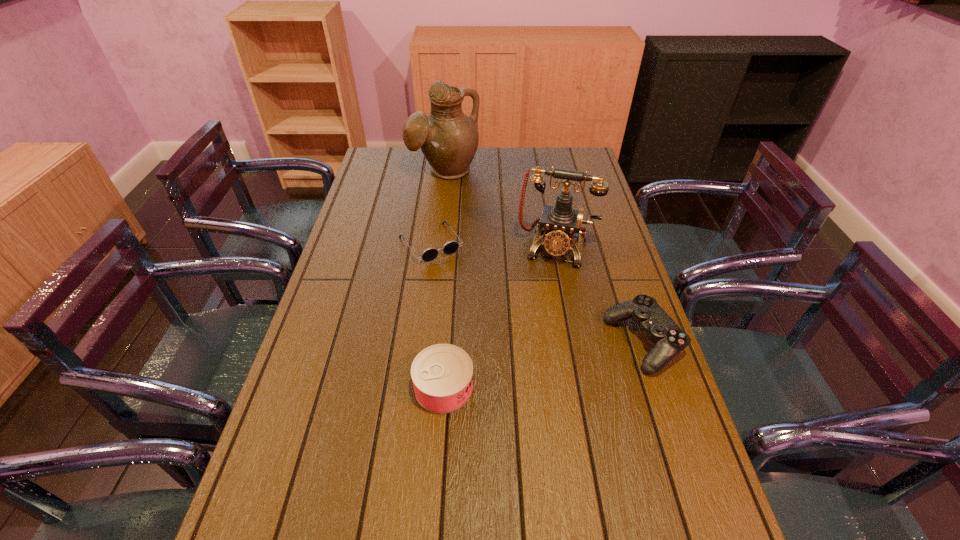
Locate an element on the screen. The image size is (960, 540). can is located at coordinates (442, 374).

Where is `control`? control is located at coordinates (670, 340).

I want to click on the second tallest object, so click(x=560, y=221).

Identify the location of the farthest object. (448, 138).

At what (x,y) coordinates should I click in order to perform the action: click on the tallest object. Please return your answer as a coordinate pair (x, y). This screenshot has height=540, width=960. Looking at the image, I should click on (448, 138).

The image size is (960, 540). In order to click on sunglasses in this screenshot , I will do `click(450, 247)`.

This screenshot has height=540, width=960. In order to click on vacant area located 0.090m on the right of the can in this screenshot , I will do `click(511, 388)`.

At what (x,y) coordinates should I click in order to perform the action: click on free point located 0.340m on the left of the control. Please return your answer as a coordinate pair (x, y). The width and height of the screenshot is (960, 540). Looking at the image, I should click on (480, 343).

At what (x,y) coordinates should I click in order to perform the action: click on vacant space located 0.270m on the front of the fourth shortest object, featuring the rotary dial. Please return your answer as a coordinate pair (x, y). The image size is (960, 540). Looking at the image, I should click on (534, 336).

This screenshot has width=960, height=540. I want to click on free region located on the front of the fourth shortest object, featuring the rotary dial, so click(x=537, y=322).